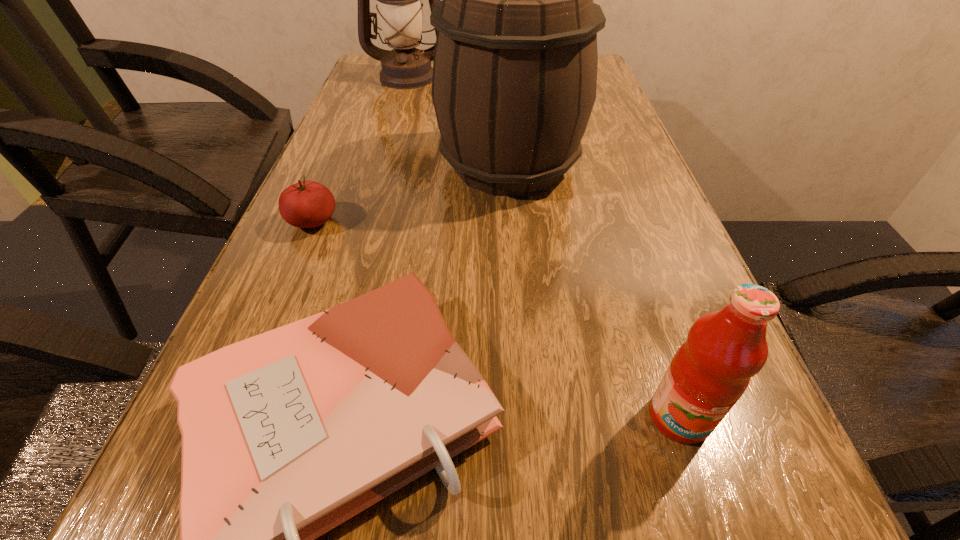
Locate an element on the screen. Image resolution: width=960 pixels, height=540 pixels. object that is the fourth closest to the tomato is located at coordinates (709, 373).

Identify the location of vacant space that satisfies the following two spatial constraints: 1. on the back side of the oil lamp; 2. on the right side of the tomato. (373, 76).